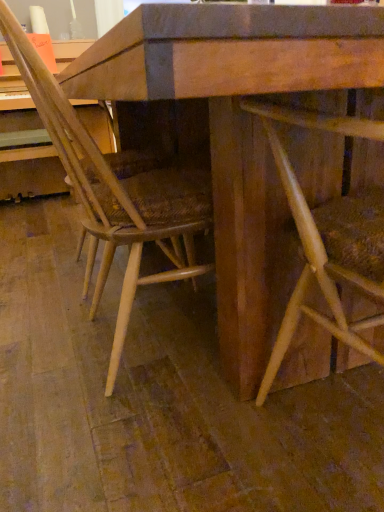
Question: From a real-world perspective, is natural wood chair at center, which is counted as the second chair, starting from the right, positioned above or below natural wood chair at center, placed as the 1th chair when sorted from right to left?

Choices:
 (A) above
 (B) below

Answer: (A)

Question: Is natural wood chair at center, which is counted as the second chair, starting from the right, inside or outside of natural wood chair at center, which is the second chair from left to right?

Choices:
 (A) outside
 (B) inside

Answer: (A)

Question: Considering their positions, is natural wood chair at center, which is counted as the second chair, starting from the right, located in front of or behind natural wood chair at center, placed as the 1th chair when sorted from right to left?

Choices:
 (A) front
 (B) behind

Answer: (B)

Question: From a real-world perspective, is natural wood chair at center, placed as the 1th chair when sorted from right to left, physically located above or below natural wood chair at center, which is counted as the second chair, starting from the right?

Choices:
 (A) below
 (B) above

Answer: (A)

Question: Considering their positions, is natural wood chair at center, which is the second chair from left to right, located in front of or behind natural wood chair at center, the first chair in the left-to-right sequence?

Choices:
 (A) behind
 (B) front

Answer: (B)

Question: Is natural wood chair at center, placed as the 1th chair when sorted from right to left, to the left or to the right of natural wood chair at center, the first chair in the left-to-right sequence, in the image?

Choices:
 (A) right
 (B) left

Answer: (A)

Question: Based on their sizes in the image, would you say natural wood chair at center, placed as the 1th chair when sorted from right to left, is bigger or smaller than natural wood chair at center, the first chair in the left-to-right sequence?

Choices:
 (A) small
 (B) big

Answer: (A)